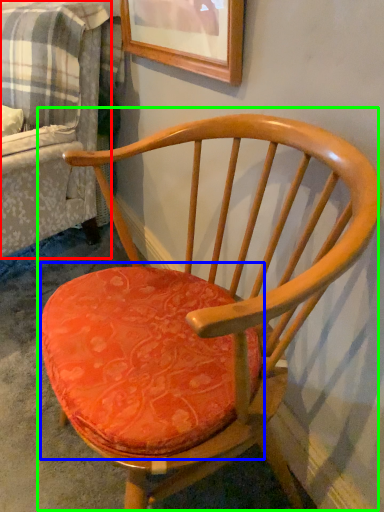
Question: Which is farther away from couch (highlighted by a red box)? table (highlighted by a blue box) or chair (highlighted by a green box)?

Choices:
 (A) table
 (B) chair

Answer: (A)